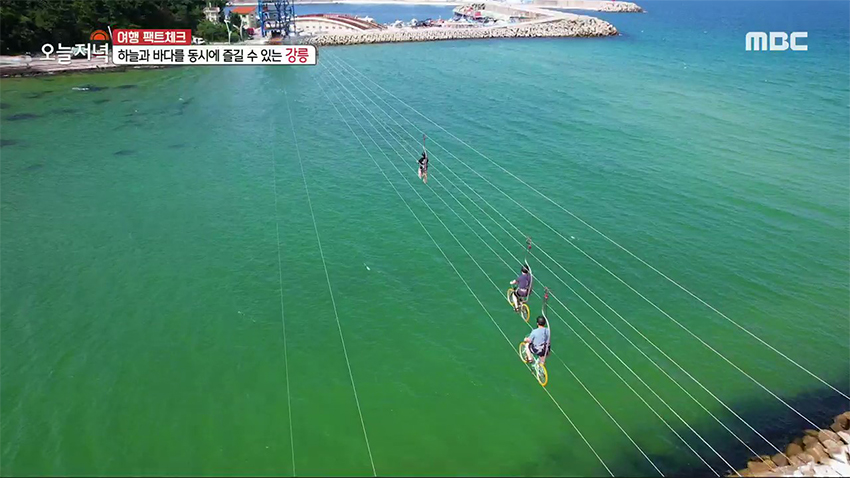
What are the coordinates of `cable` in the screenshot? It's located at (287, 416).